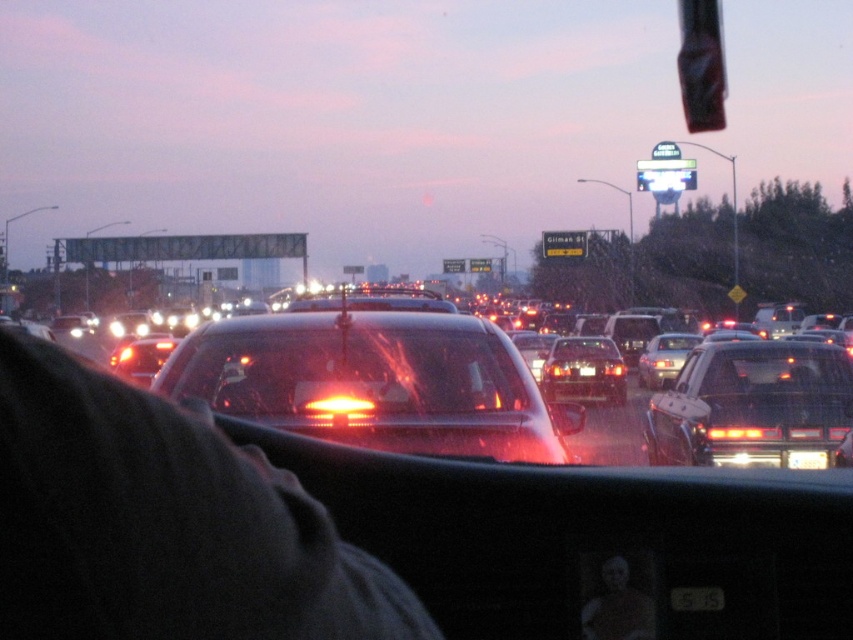
You are driving a car and want to know what is directly in front of you. According to the image, what is located at the point with coordinates (386, 380)?

The point at coordinates (386, 380) indicates a glossy black sedan at center, so the glossy black sedan at center is directly in front of you.

You are a passenger in a car and want to look at the transparent glass windshield at center and the matte black suv at right outside. Which object would you see as closer to you?

The transparent glass windshield at center is closer to you since it is part of your vehicle, while the matte black suv at right is further away in the traffic ahead.

You are driving a car and notice two points on the road ahead. The first point is at coordinates point (386, 381) and the second is at point (706, 461). Based on the scene description, which point is closer to your car?

Point (386, 381) is closer to your car because it is in front of point (706, 461).